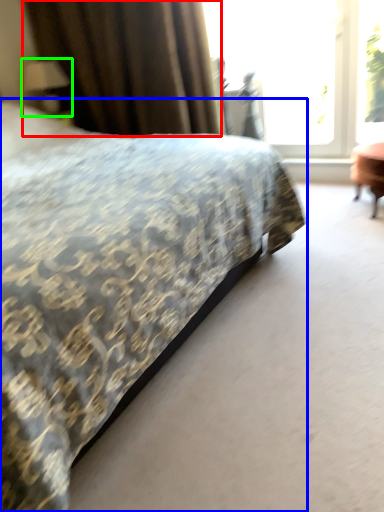
Question: Estimate the real-world distances between objects in this image. Which object is farther from curtain (highlighted by a red box), bed (highlighted by a blue box) or table lamp (highlighted by a green box)?

Choices:
 (A) bed
 (B) table lamp

Answer: (A)